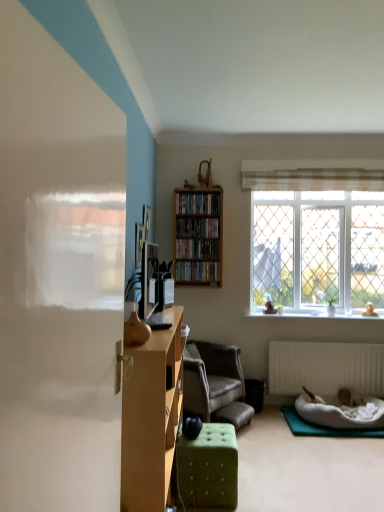
This screenshot has width=384, height=512. In order to click on spots to the right of green fabric ottoman at lower center in this screenshot , I will do `click(264, 489)`.